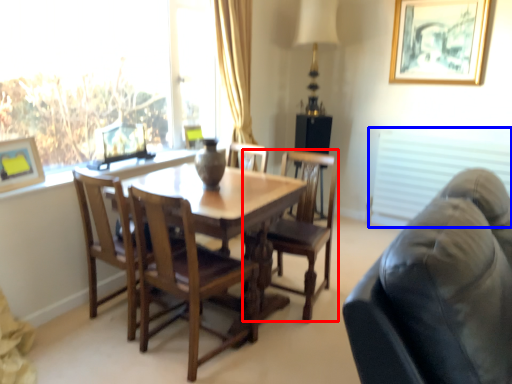
Question: Which object appears farthest to the camera in this image, chair (highlighted by a red box) or blind (highlighted by a blue box)?

Choices:
 (A) chair
 (B) blind

Answer: (B)